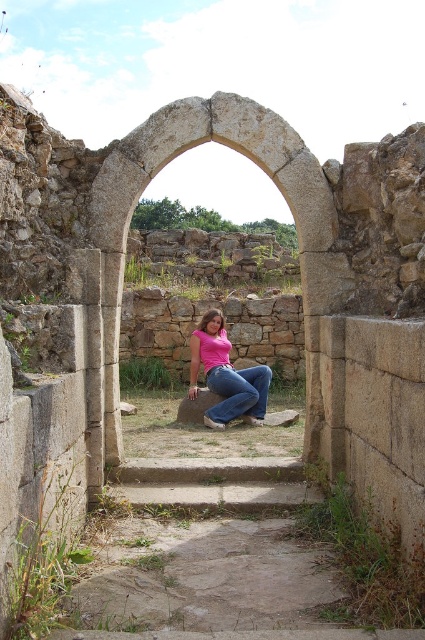
You are standing at the entrance of the ancient ruin and want to reach the person sitting on the stone structure. Which direction should you move relative to the gray concrete stairs at center?

You should move towards the gray concrete stairs at center because they are positioned at point (214, 483), which is directly in the path leading to the person on the stone structure.

You are standing at the entrance of the ancient ruin and want to reach the person sitting on the stone structure. The gray concrete stairs at center are your only path. Can you use the stairs to approach them safely?

The gray concrete stairs at center are located at point (214, 483), which suggests they are positioned centrally and likely lead directly to the stone platform where the person is sitting. Yes, you can safely use the stairs to approach them.